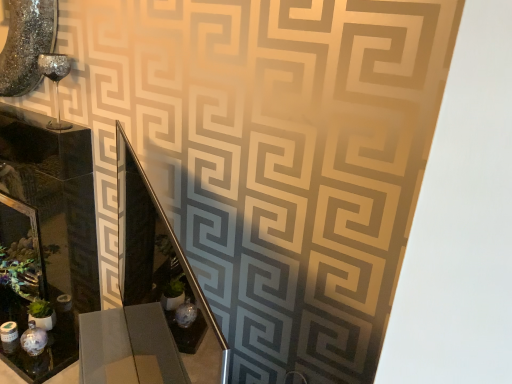
Question: Can you confirm if metallic silver vanity at center is bigger than matte glass picture frame at lower left?

Choices:
 (A) yes
 (B) no

Answer: (A)

Question: Does metallic silver vanity at center have a smaller size compared to matte glass picture frame at lower left?

Choices:
 (A) no
 (B) yes

Answer: (A)

Question: Would you say matte glass picture frame at lower left is part of metallic silver vanity at center's contents?

Choices:
 (A) yes
 (B) no

Answer: (B)

Question: Does metallic silver vanity at center appear on the right side of matte glass picture frame at lower left?

Choices:
 (A) no
 (B) yes

Answer: (B)

Question: Is metallic silver vanity at center facing away from matte glass picture frame at lower left?

Choices:
 (A) no
 (B) yes

Answer: (A)

Question: Does metallic silver vanity at center lie behind matte glass picture frame at lower left?

Choices:
 (A) yes
 (B) no

Answer: (B)

Question: From the image's perspective, is matte black glass box at left under metallic silver vanity at center?

Choices:
 (A) no
 (B) yes

Answer: (A)

Question: From a real-world perspective, is matte black glass box at left physically below metallic silver vanity at center?

Choices:
 (A) no
 (B) yes

Answer: (B)

Question: Is matte black glass box at left facing towards metallic silver vanity at center?

Choices:
 (A) yes
 (B) no

Answer: (B)

Question: Can you confirm if matte black glass box at left is shorter than metallic silver vanity at center?

Choices:
 (A) no
 (B) yes

Answer: (A)

Question: Is matte black glass box at left closer to camera compared to metallic silver vanity at center?

Choices:
 (A) yes
 (B) no

Answer: (B)

Question: Is matte black glass box at left further to camera compared to metallic silver vanity at center?

Choices:
 (A) yes
 (B) no

Answer: (A)

Question: Is metallic silver vanity at center not near matte black glass box at left?

Choices:
 (A) no
 (B) yes

Answer: (A)